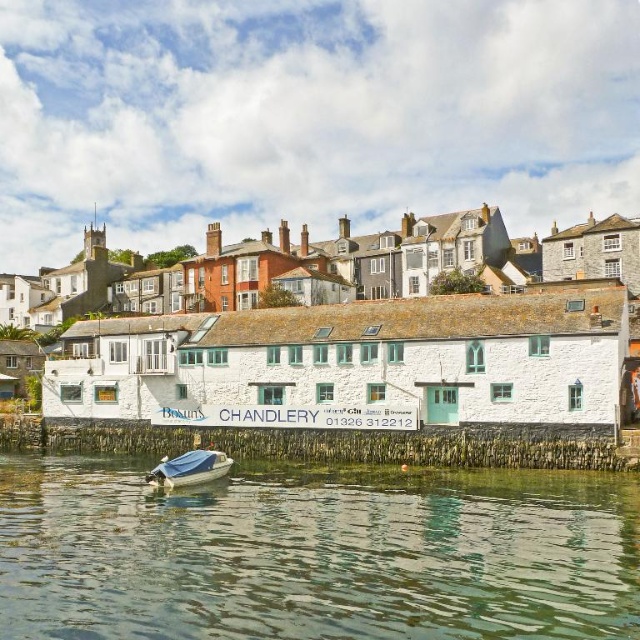
You are standing at the waterfront and want to visit the white stone building at center. If your walking speed is 3 feet per second, how many seconds will it take you to reach the building?

The white stone building at center is 211.16 feet away from you. At a walking speed of 3 feet per second, it will take approximately 70.39 seconds to reach it.

You are standing on a wooden pier and want to take a photo of the white stone building at center. However, the greenish water at lower center is blocking your view. Can you move to the right to avoid the water? Explain why or why not based on their positions.

The greenish water at lower center is closer to the viewer than the white stone building at center. Moving to the right might not help because the water is in front of the building, so shifting sideways could still leave the water between you and the building unless you move far enough back to see over it.

You are standing at the edge of the waterfront and notice the greenish water at lower center. Can you determine its exact location based on the coordinates provided?

The greenish water at lower center is located at point coordinates of (314, 554).